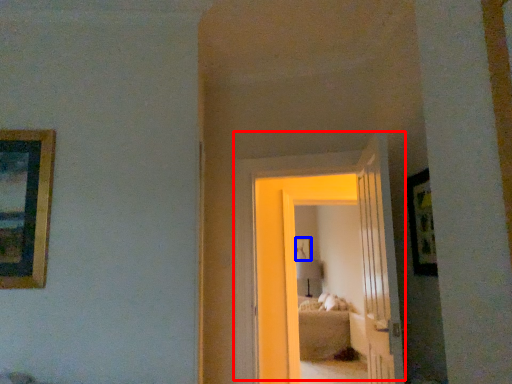
Question: Which of the following is the farthest to the observer, door (highlighted by a red box) or picture frame (highlighted by a blue box)?

Choices:
 (A) door
 (B) picture frame

Answer: (B)